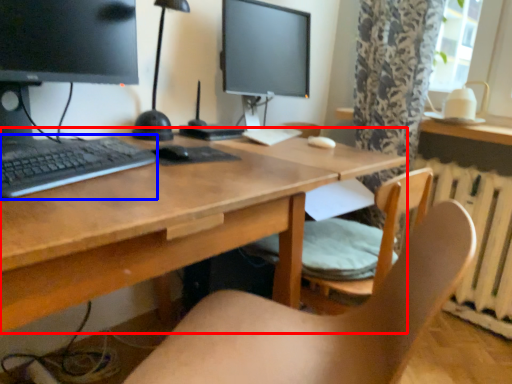
Question: Among these objects, which one is farthest to the camera, desk (highlighted by a red box) or computer keyboard (highlighted by a blue box)?

Choices:
 (A) desk
 (B) computer keyboard

Answer: (B)